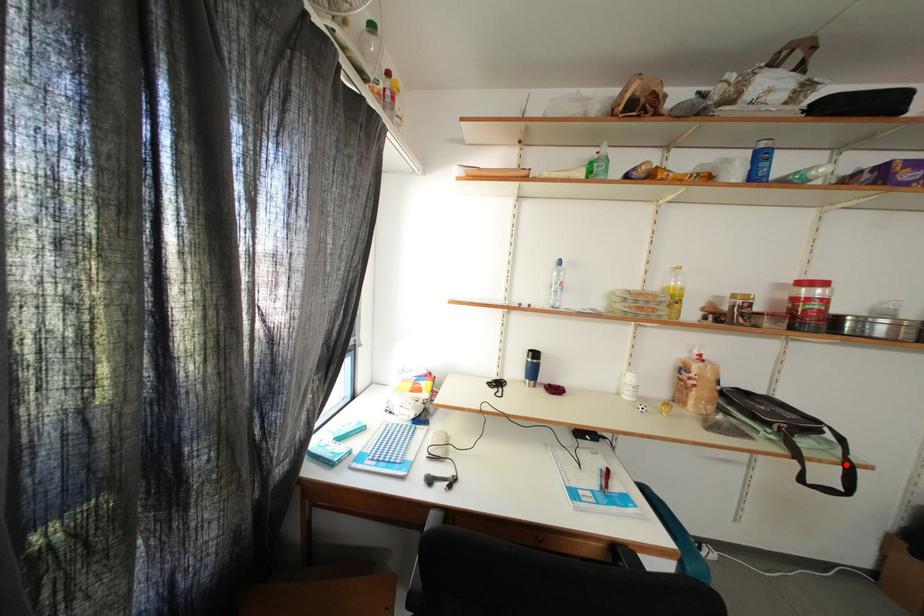
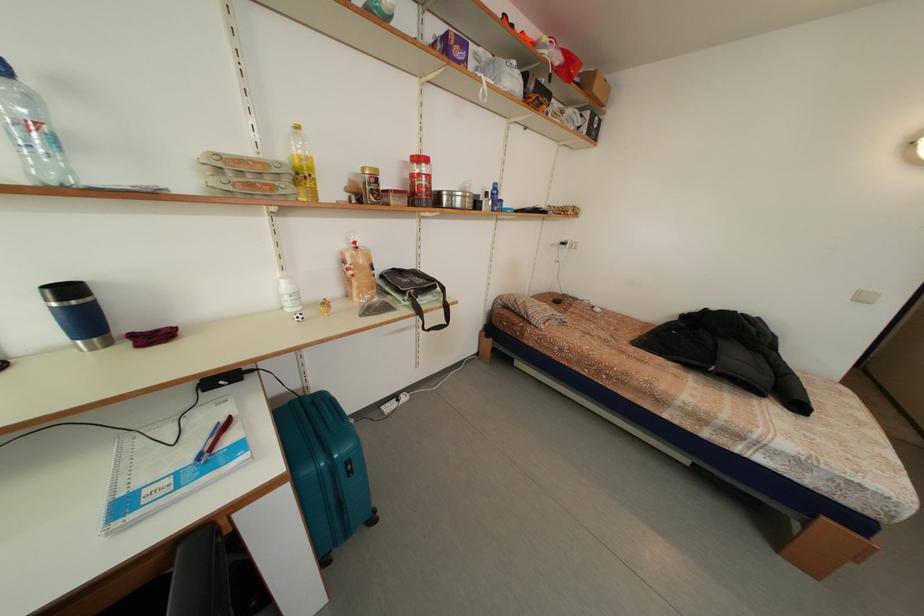
The point at the highlighted location is marked in the first image. Where is the corresponding point in the second image?

(448, 310)